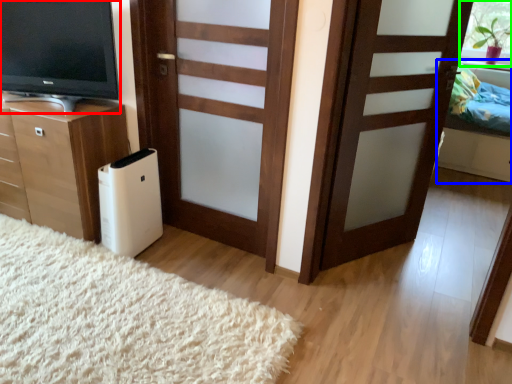
Question: Which is nearer to the television (highlighted by a red box)? bed (highlighted by a blue box) or window screen (highlighted by a green box).

Choices:
 (A) bed
 (B) window screen

Answer: (A)